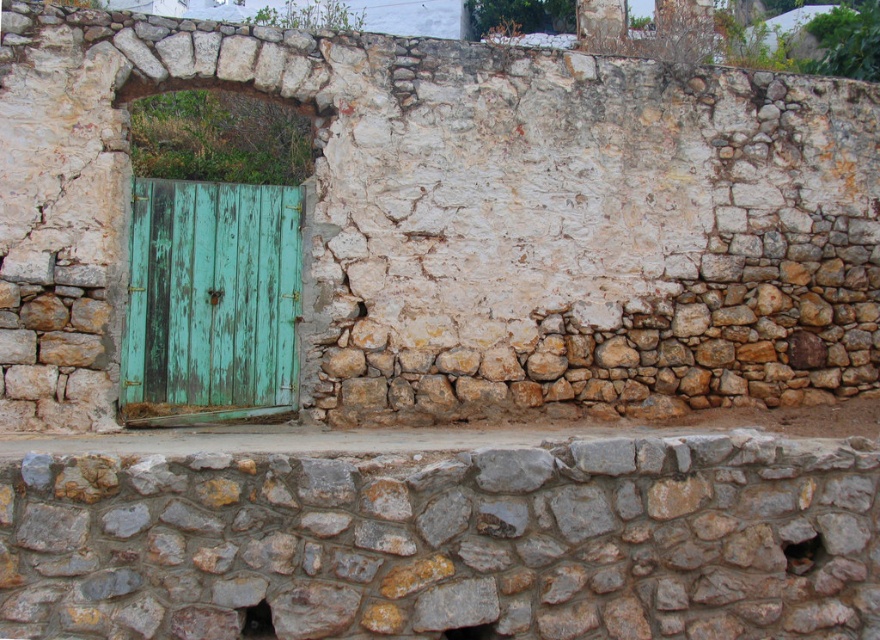
How much distance is there between rustic stone wall at center and green weathered wood door at left?

rustic stone wall at center and green weathered wood door at left are 2.55 meters apart.

Does point (303, 476) come farther from viewer compared to point (220, 390)?

No, (303, 476) is closer to viewer.

This screenshot has width=880, height=640. Find the location of `rustic stone wall at center`. rustic stone wall at center is located at coordinates [449, 541].